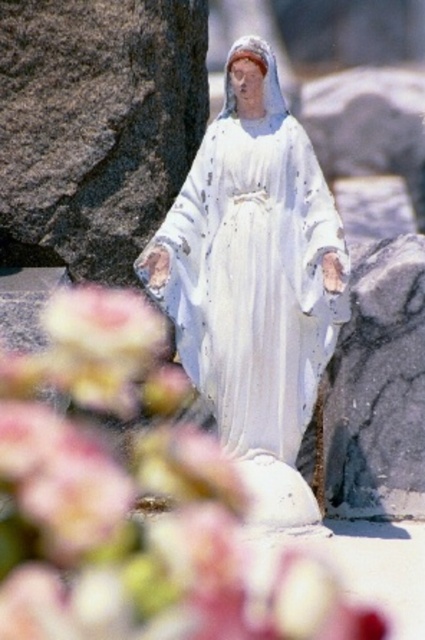
Question: Is blurred floral petals at center bigger than white glossy statue at center?

Choices:
 (A) yes
 (B) no

Answer: (A)

Question: Considering the relative positions of blurred floral petals at center and white glossy statue at center in the image provided, where is blurred floral petals at center located with respect to white glossy statue at center?

Choices:
 (A) left
 (B) right

Answer: (A)

Question: Can you confirm if blurred floral petals at center is thinner than white glossy statue at center?

Choices:
 (A) yes
 (B) no

Answer: (B)

Question: Among these points, which one is nearest to the camera?

Choices:
 (A) (127, 524)
 (B) (289, 304)

Answer: (A)

Question: Which point is farther to the camera?

Choices:
 (A) (34, 472)
 (B) (320, 355)

Answer: (B)